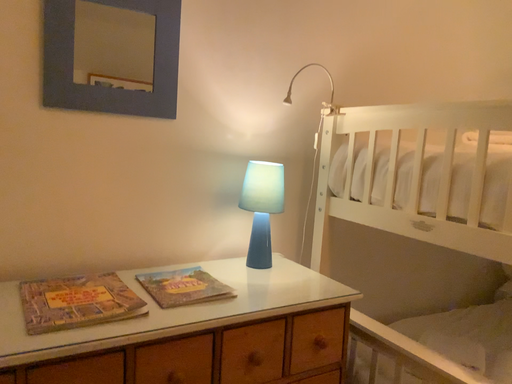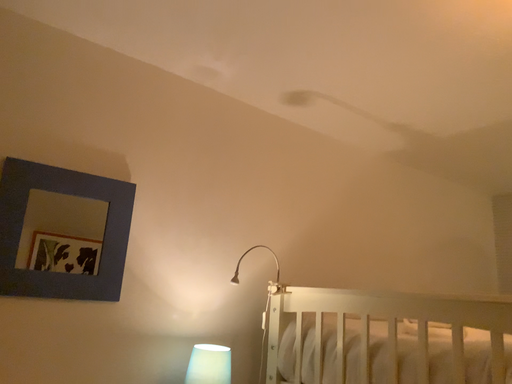
Question: How did the camera likely rotate when shooting the video?

Choices:
 (A) rotated right
 (B) rotated left

Answer: (A)